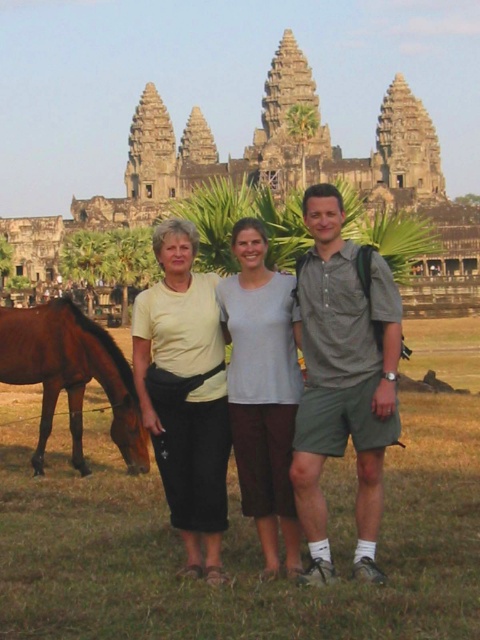
Question: Is light yellow cotton shirt at center behind yellow fabric at center?

Choices:
 (A) yes
 (B) no

Answer: (B)

Question: Among these points, which one is farthest from the camera?

Choices:
 (A) (360, 298)
 (B) (206, 358)
 (C) (400, 320)

Answer: (B)

Question: Can you confirm if light gray cotton shirt at center is smaller than brown glossy horse at lower left?

Choices:
 (A) yes
 (B) no

Answer: (A)

Question: Which point is closer to the camera taking this photo?

Choices:
 (A) (268, 461)
 (B) (340, 451)

Answer: (B)

Question: Is light yellow cotton shirt at center below matte gray shirt at center?

Choices:
 (A) yes
 (B) no

Answer: (A)

Question: Which object is the farthest from the light yellow cotton shirt at center?

Choices:
 (A) yellow fabric at center
 (B) brown glossy horse at lower left
 (C) matte gray shirt at center
 (D) light gray cotton shirt at center

Answer: (B)